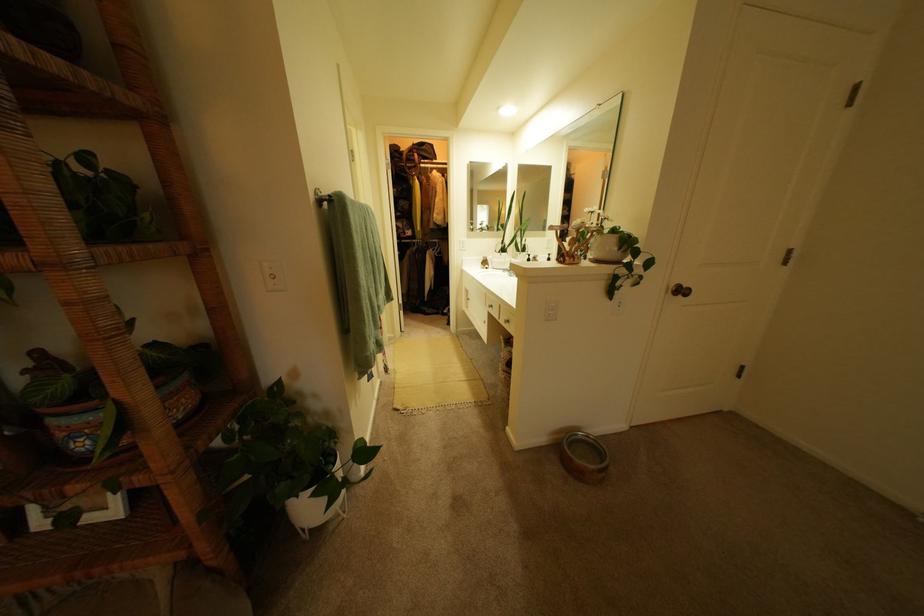
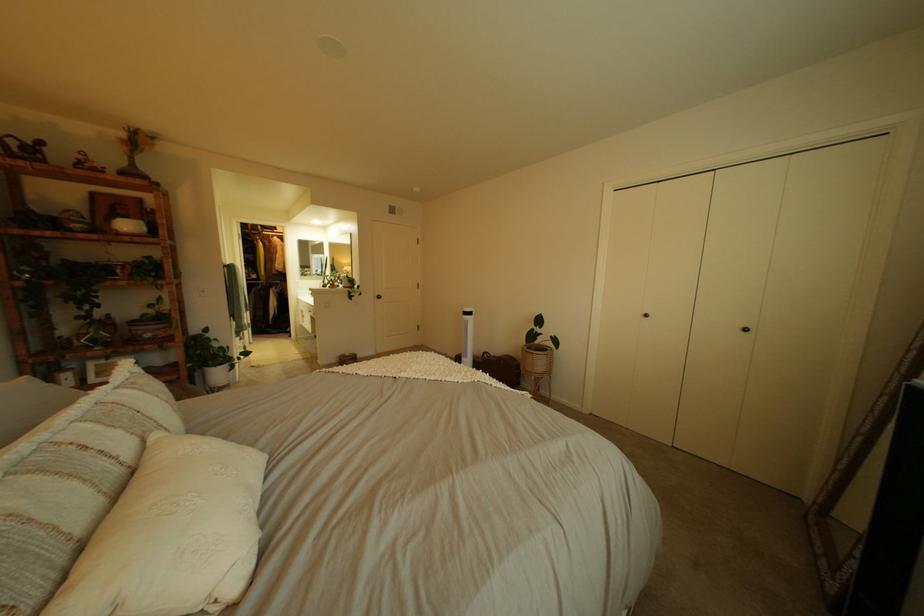
Where in the second image is the point corresponding to (x=197, y=556) from the first image?

(189, 379)